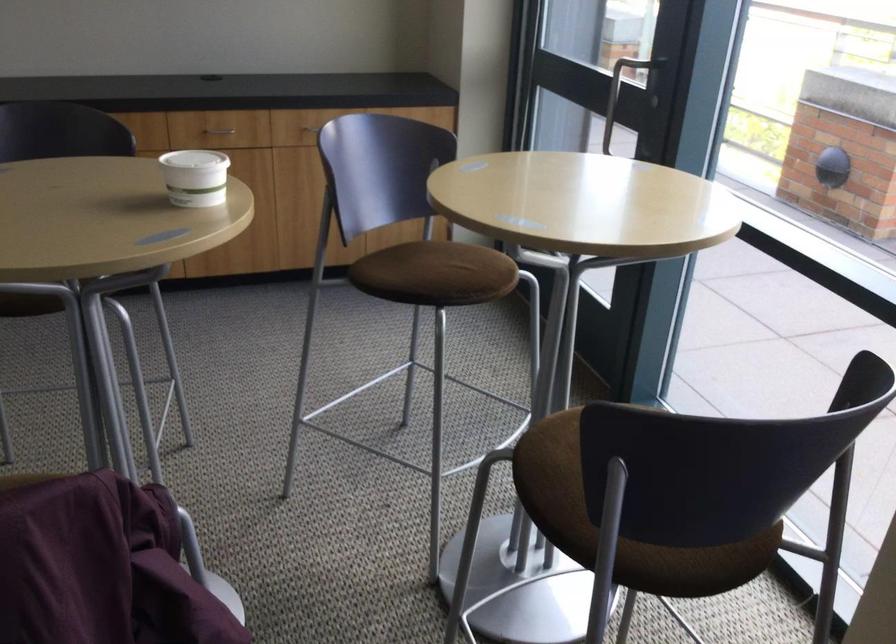
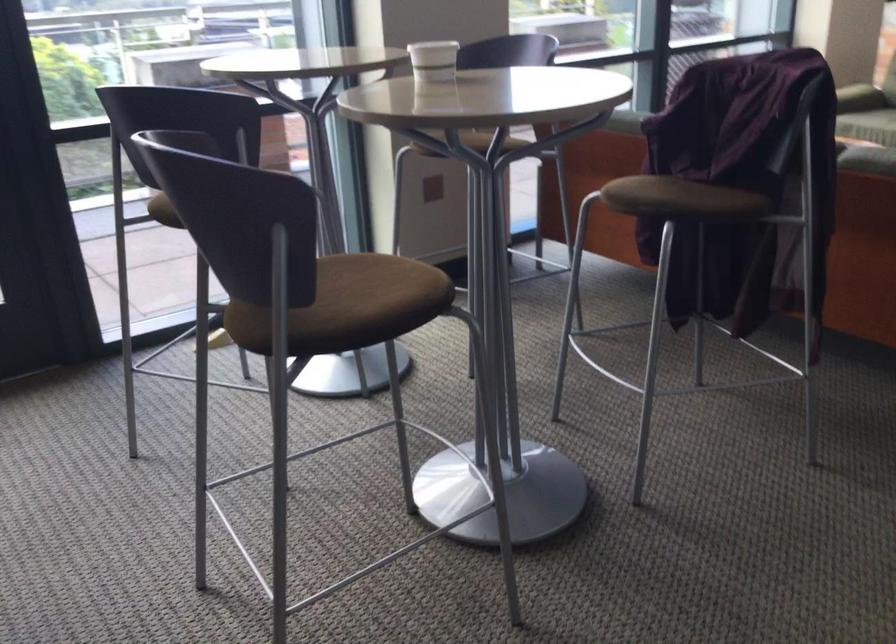
Where in the second image is the point corresponding to [428,247] from the first image?

(162, 211)